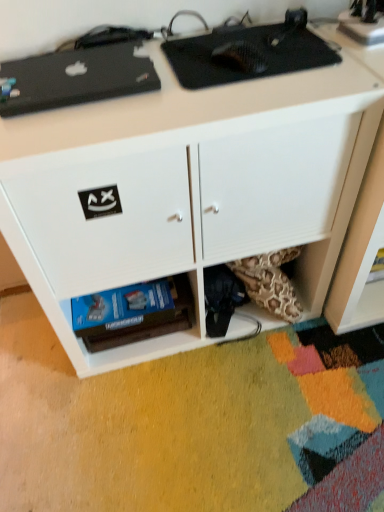
Question: From a real-world perspective, relative to black matte laptop at upper left, the third appliance positioned from the right, is black carbon fiber mouse pad at upper center, arranged as the second appliance when viewed from the left, vertically above or below?

Choices:
 (A) below
 (B) above

Answer: (A)

Question: Would you say black carbon fiber mouse pad at upper center, arranged as the second appliance when viewed from the left, is to the left or to the right of black matte laptop at upper left, positioned as the 1th appliance in left-to-right order, in the picture?

Choices:
 (A) right
 (B) left

Answer: (A)

Question: Which object is the closest to the metallic silver speaker at upper right, placed as the first appliance when sorted from right to left?

Choices:
 (A) black matte laptop at upper left, the third appliance positioned from the right
 (B) black carbon fiber mouse pad at upper center, the second appliance in the right-to-left sequence
 (C) white matte desk at upper center

Answer: (B)

Question: Which object is positioned closest to the black matte laptop at upper left, positioned as the 1th appliance in left-to-right order?

Choices:
 (A) black carbon fiber mouse pad at upper center, the second appliance in the right-to-left sequence
 (B) white matte desk at upper center
 (C) metallic silver speaker at upper right, the 3th appliance from the left

Answer: (A)